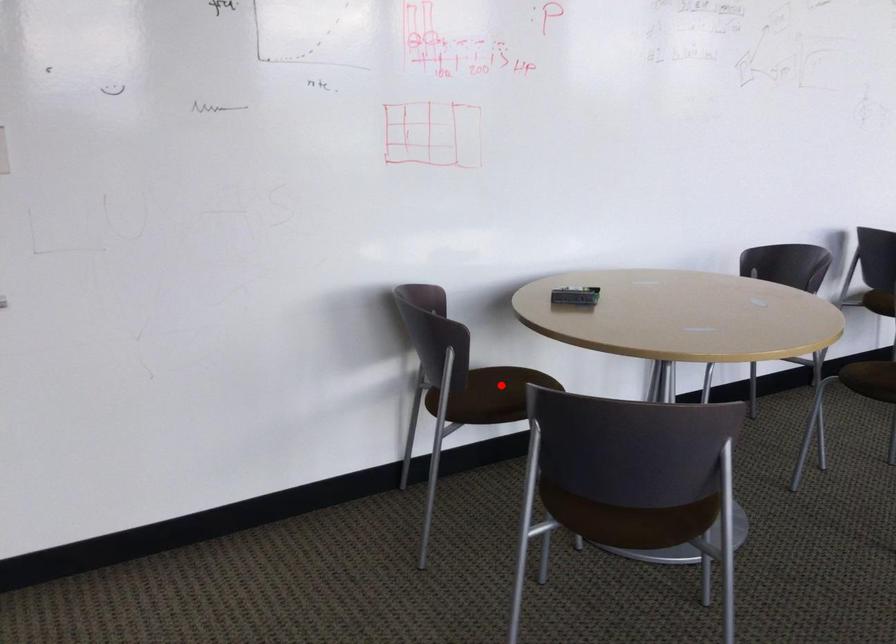
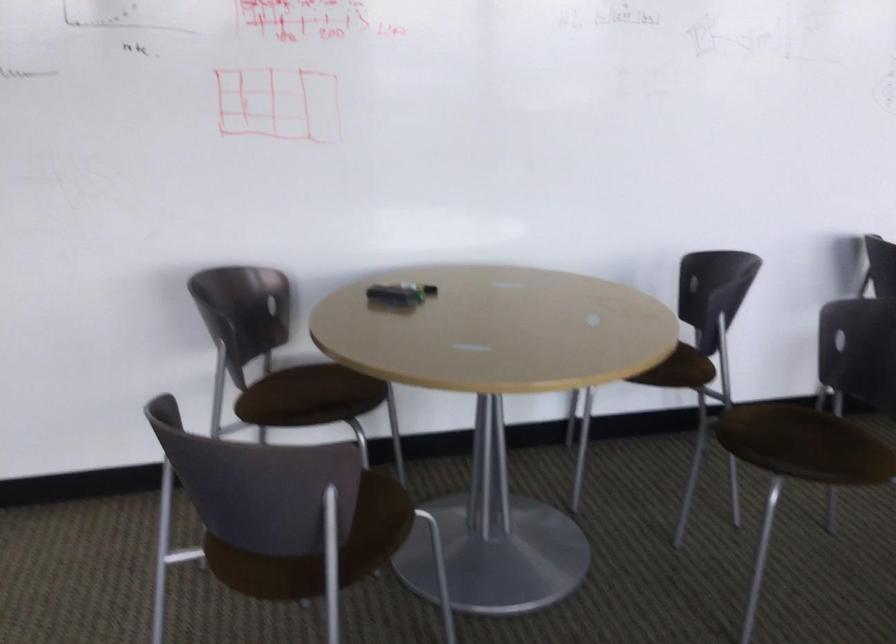
Find the pixel in the second image that matches the highlighted location in the first image.

(314, 384)